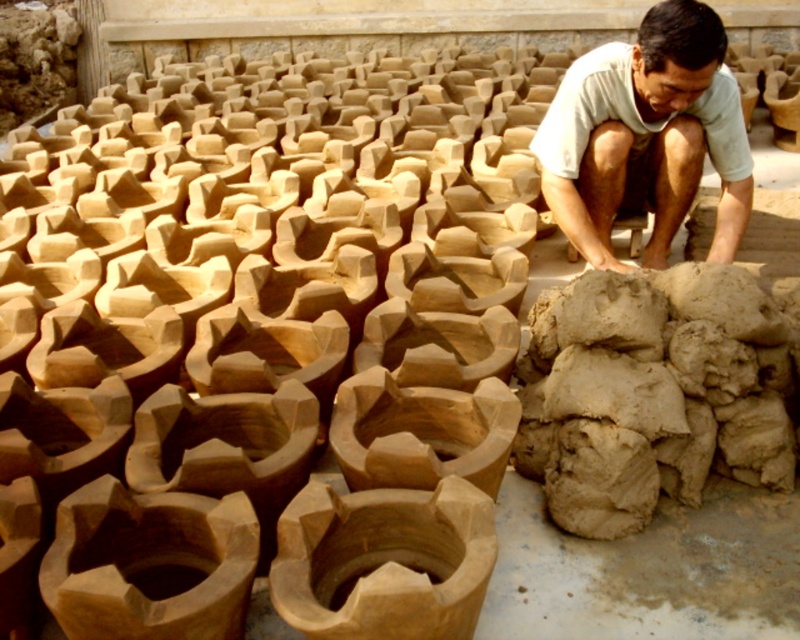
Does clay at lower right appear on the left side of light brown clay at center?

Correct, you'll find clay at lower right to the left of light brown clay at center.

Based on the photo, can you confirm if clay at lower right is shorter than light brown clay at center?

Correct, clay at lower right is not as tall as light brown clay at center.

The height and width of the screenshot is (640, 800). Identify the location of clay at lower right. (652, 392).

Identify the location of clay at lower right. (652, 392).